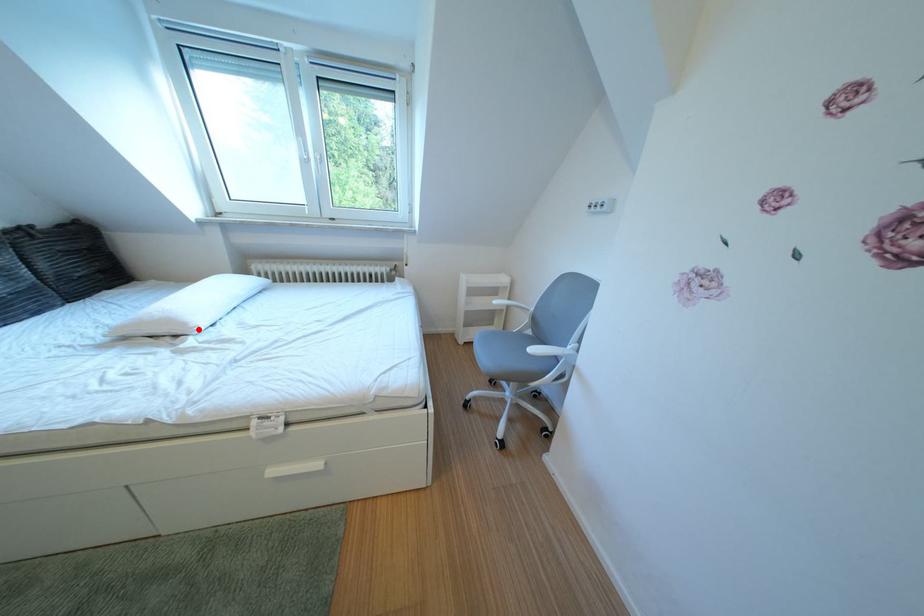
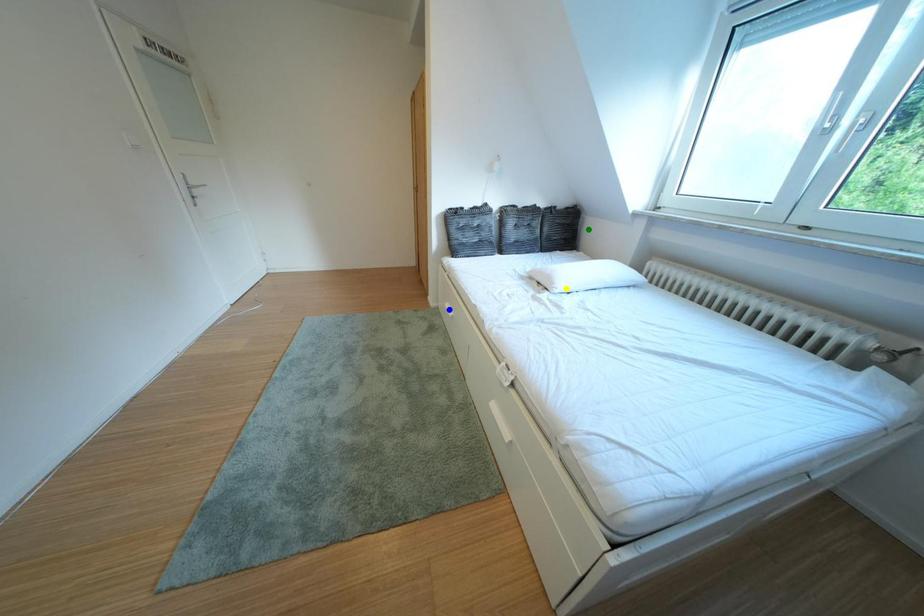
Question: I am providing you with two images of the same scene from different viewpoints. A red point is marked on the first image. You are given multiple points on the second image. In image 2, which mark is for the same physical point as the one in image 1?

Choices:
 (A) green point
 (B) blue point
 (C) yellow point

Answer: (C)